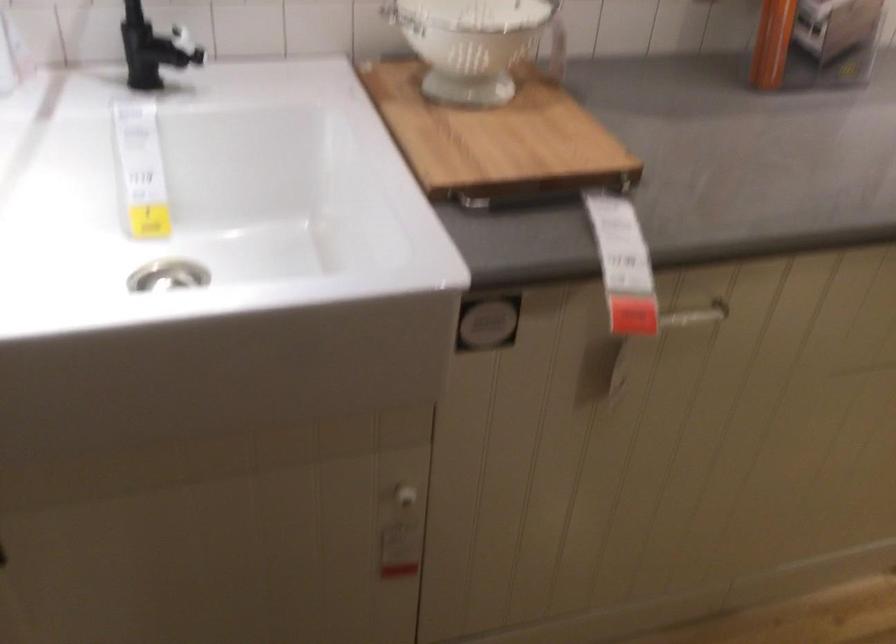
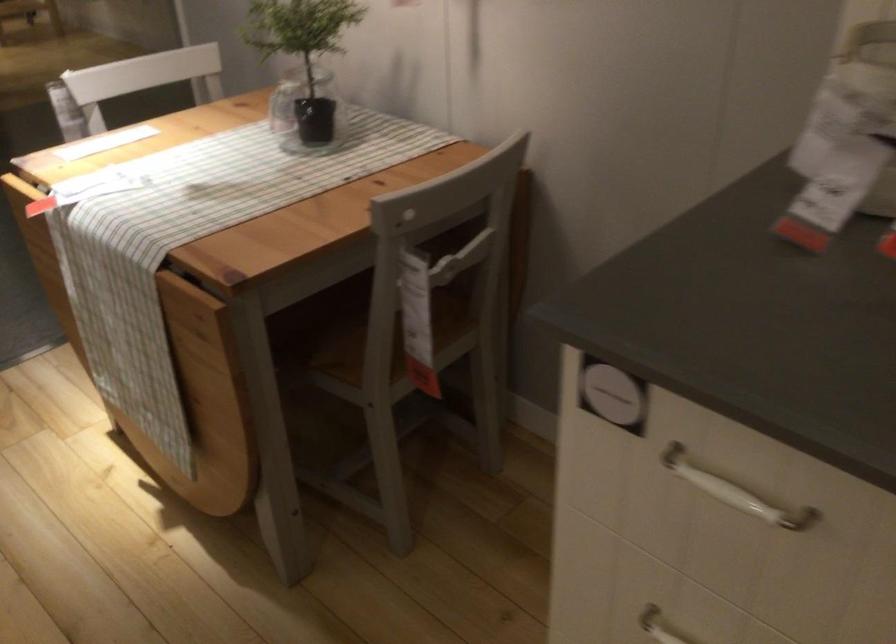
First-person continuous shooting, in which direction is the camera rotating?

The camera's rotation is toward right-down.